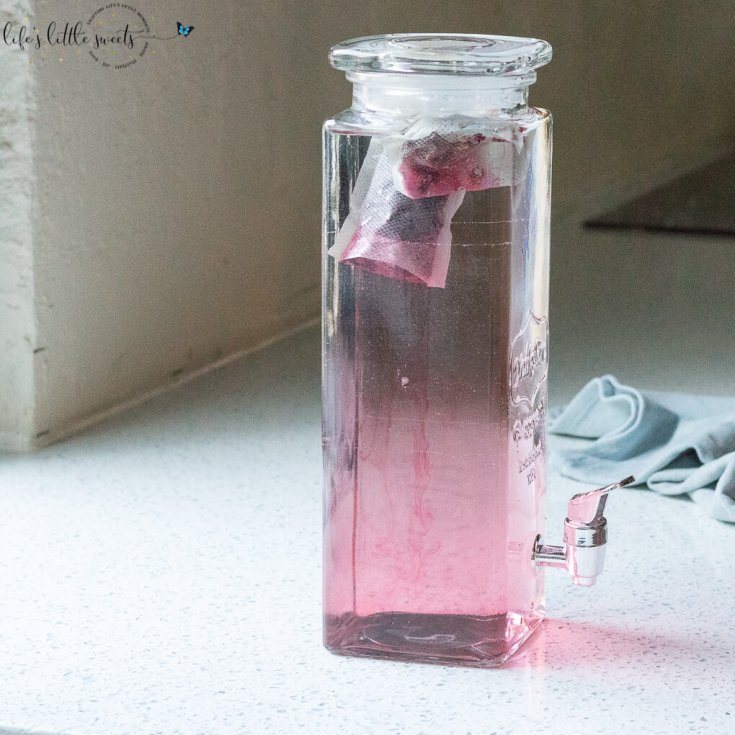
This screenshot has height=735, width=735. Find the location of `glass jar`. glass jar is located at coordinates point(340,140).